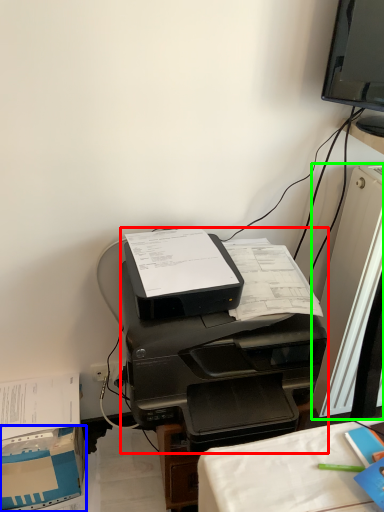
Question: Which object is positioned closest to printer (highlighted by a red box)? Select from cardboard box (highlighted by a blue box) and desktop computer (highlighted by a green box).

Choices:
 (A) cardboard box
 (B) desktop computer

Answer: (B)